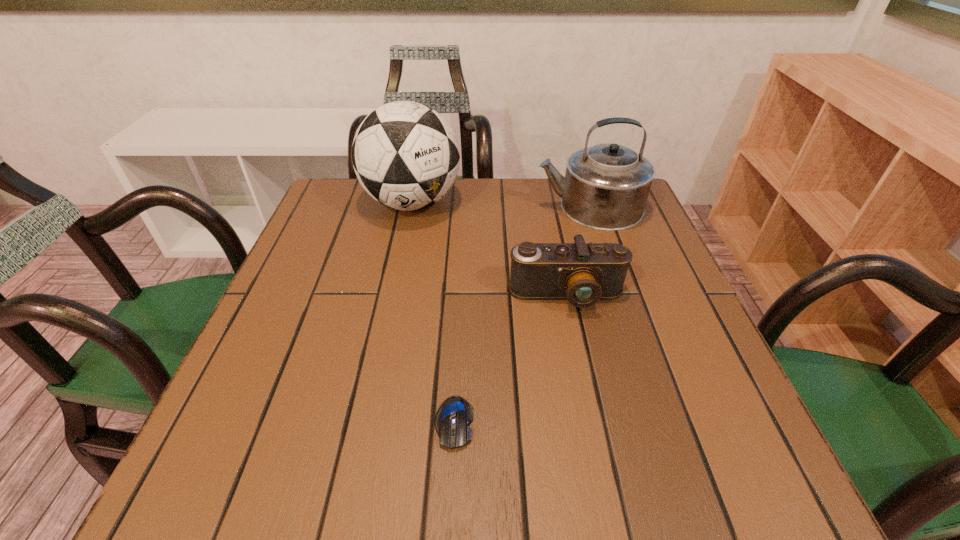
This screenshot has height=540, width=960. In order to click on blank space at the left edge of the desktop in this screenshot , I will do `click(302, 252)`.

In the image, there is a desktop. Identify the location of vacant region at the right edge. (632, 262).

This screenshot has width=960, height=540. I want to click on free space at the far left corner of the desktop, so click(x=340, y=198).

You are a GUI agent. You are given a task and a screenshot of the screen. Output one action in this format:
    pyautogui.click(x=<x>, y=<y>)
    Task: Click on the free space between the computer mouse and the kettle
    The width and height of the screenshot is (960, 540).
    Given the screenshot: What is the action you would take?
    pyautogui.click(x=521, y=315)

This screenshot has width=960, height=540. In order to click on free space between the camera and the computer mouse in this screenshot , I will do `click(510, 359)`.

Locate an element on the screen. free space between the soccer ball and the camera is located at coordinates (490, 249).

Identify the location of free space between the second nearest object and the soccer ball. (490, 249).

In order to click on free point between the soccer ball and the second nearest object in this screenshot , I will do `click(490, 249)`.

The width and height of the screenshot is (960, 540). Identify the location of vacant area between the kettle and the soccer ball. (500, 205).

Image resolution: width=960 pixels, height=540 pixels. Find the location of `unoccupied area between the kettle and the soccer ball`. unoccupied area between the kettle and the soccer ball is located at coordinates (500, 205).